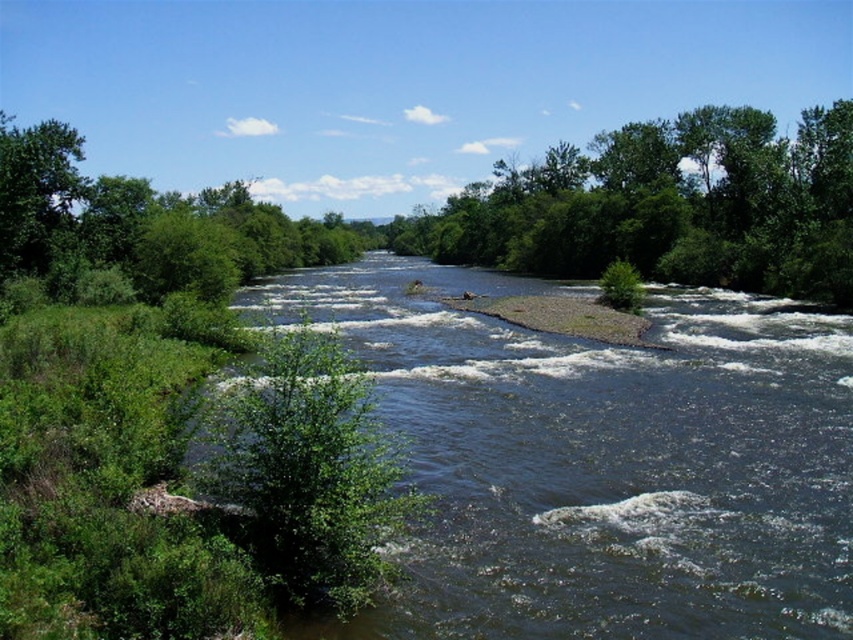
In the scene shown: You are a bird flying over the river scene. You see the green leafy tree at center and the green leafy tree at left. Which tree is positioned higher in the image?

The green leafy tree at center is positioned higher in the image than the green leafy tree at left.

You are a photographer planning to capture a landscape photo of the dark blue water at center and the green leafy tree at center. Which object will appear taller in the photo?

The green leafy tree at center is taller than the dark blue water at center, so it will appear taller in the photo.

You are a bird flying over a river and want to land on the closest tree. You see the green leafy tree at center and the green leafy tree at left. Which tree is closer to you?

The green leafy tree at left is closer to you because it is positioned to the left of the green leafy tree at center, which is further away.